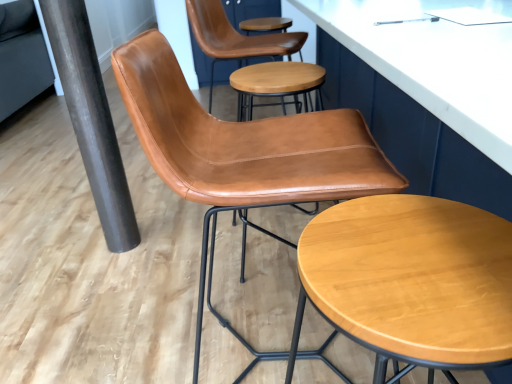
Find the location of `vacant area to the right of black metallic pole at lower left`. vacant area to the right of black metallic pole at lower left is located at coordinates 164,237.